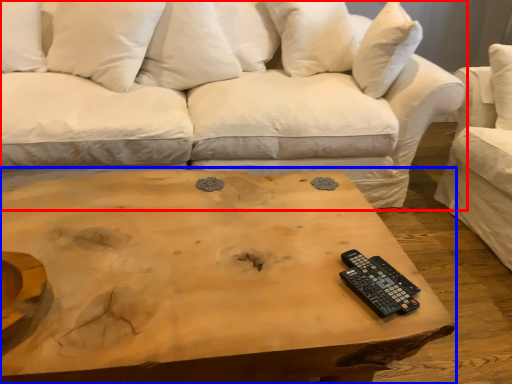
Question: Which object is closer to the camera taking this photo, studio couch (highlighted by a red box) or coffee table (highlighted by a blue box)?

Choices:
 (A) studio couch
 (B) coffee table

Answer: (B)